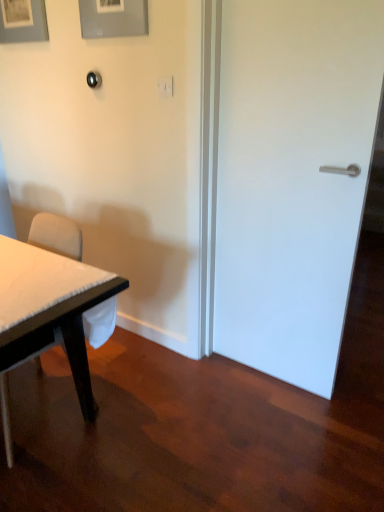
Where is `white matte door at right`? white matte door at right is located at coordinates (292, 179).

Find the location of a particular element. This screenshot has height=512, width=384. white fabric chair at left is located at coordinates (56, 234).

Is white matte door at right outside of white fabric chair at left?

white matte door at right is positioned outside white fabric chair at left.

I want to click on door that is behind the white fabric chair at left, so click(x=292, y=179).

Which object is more forward, white matte door at right or white fabric chair at left?

white fabric chair at left is closer to the camera.

From a real-world perspective, between white matte door at right and white fabric chair at left, who is vertically lower?

white fabric chair at left is physically lower.

Looking at this image, from the image's perspective, who appears lower, matte gray picture frame at upper center, which is the 2th picture frame in back-to-front order, or matte gray picture frame at upper left, which is the first picture frame from left to right?

matte gray picture frame at upper center, which is the 2th picture frame in back-to-front order, appears lower in the image.

Which object is thinner, matte gray picture frame at upper center, which is the 1th picture frame from right to left, or matte gray picture frame at upper left, which is the 2th picture frame in right-to-left order?

With smaller width is matte gray picture frame at upper center, which is the 1th picture frame from right to left.

Who is shorter, matte gray picture frame at upper center, acting as the first picture frame starting from the front, or matte gray picture frame at upper left, which appears as the 1th picture frame when viewed from the back?

matte gray picture frame at upper center, acting as the first picture frame starting from the front, is shorter.

Relative to matte gray picture frame at upper left, which is the 2th picture frame in right-to-left order, is matte gray picture frame at upper center, acting as the first picture frame starting from the front, in front or behind?

In the image, matte gray picture frame at upper center, acting as the first picture frame starting from the front, appears in front of matte gray picture frame at upper left, which is the 2th picture frame in right-to-left order.

Is white matte door at right outside of matte gray picture frame at upper center, which is the 2th picture frame in back-to-front order?

white matte door at right lies outside matte gray picture frame at upper center, which is the 2th picture frame in back-to-front order,'s area.

From the image's perspective, is white matte door at right above matte gray picture frame at upper center, the 2th picture frame from the left?

Actually, white matte door at right appears below matte gray picture frame at upper center, the 2th picture frame from the left, in the image.

From a real-world perspective, which is physically below, white matte door at right or matte gray picture frame at upper center, the 2th picture frame from the left?

In real-world perspective, white matte door at right is lower.

Could you measure the distance between white matte door at right and matte gray picture frame at upper center, which is the 2th picture frame in back-to-front order?

white matte door at right is 35.97 inches from matte gray picture frame at upper center, which is the 2th picture frame in back-to-front order.

From the image's perspective, does matte gray picture frame at upper left, which appears as the 1th picture frame when viewed from the back, appear lower than white fabric chair at left?

No, from the image's perspective, matte gray picture frame at upper left, which appears as the 1th picture frame when viewed from the back, is not below white fabric chair at left.

Is matte gray picture frame at upper left, which is the first picture frame from left to right, positioned before white fabric chair at left?

No, it is not.

Consider the image. From a real-world perspective, which object stands above the other?

matte gray picture frame at upper left, which is the first picture frame from left to right.

Which is more distant, (47, 27) or (9, 460)?

Point (47, 27)

From a real-world perspective, is matte gray picture frame at upper left, which is the 2th picture frame in right-to-left order, positioned over white matte door at right based on gravity?

Yes, from a real-world perspective, matte gray picture frame at upper left, which is the 2th picture frame in right-to-left order, is above white matte door at right.

Considering the sizes of objects matte gray picture frame at upper left, which is the 2th picture frame in right-to-left order, and white matte door at right in the image provided, who is shorter, matte gray picture frame at upper left, which is the 2th picture frame in right-to-left order, or white matte door at right?

matte gray picture frame at upper left, which is the 2th picture frame in right-to-left order.

Considering the sizes of objects matte gray picture frame at upper left, which is the 2th picture frame in right-to-left order, and white matte door at right in the image provided, who is wider, matte gray picture frame at upper left, which is the 2th picture frame in right-to-left order, or white matte door at right?

Wider between the two is matte gray picture frame at upper left, which is the 2th picture frame in right-to-left order.

Between point (27, 37) and point (241, 93), which one is positioned behind?

The point (27, 37) is farther.

How many degrees apart are the facing directions of white fabric chair at left and matte gray picture frame at upper center, the 2th picture frame from the left?

white fabric chair at left and matte gray picture frame at upper center, the 2th picture frame from the left, are facing 4.61 degrees away from each other.

Considering the positions of objects white fabric chair at left and matte gray picture frame at upper center, which is the 2th picture frame in back-to-front order, in the image provided, who is more to the left, white fabric chair at left or matte gray picture frame at upper center, which is the 2th picture frame in back-to-front order,?

From the viewer's perspective, white fabric chair at left appears more on the left side.

This screenshot has height=512, width=384. In order to click on chair below the matte gray picture frame at upper center, the 2th picture frame from the left (from a real-world perspective) in this screenshot , I will do `click(56, 234)`.

From a real-world perspective, does white fabric chair at left stand above matte gray picture frame at upper center, the 2th picture frame from the left?

No, from a real-world perspective, white fabric chair at left is not over matte gray picture frame at upper center, the 2th picture frame from the left

Is matte gray picture frame at upper left, acting as the 2th picture frame starting from the front, bigger than matte gray picture frame at upper center, the 2th picture frame from the left?

Indeed, matte gray picture frame at upper left, acting as the 2th picture frame starting from the front, has a larger size compared to matte gray picture frame at upper center, the 2th picture frame from the left.

Which is further, (29,5) or (86,36)?

The point (29,5) is farther.

Would you say matte gray picture frame at upper left, which is the first picture frame from left to right, is a long distance from matte gray picture frame at upper center, acting as the first picture frame starting from the front?

They are positioned close to each other.

Where is `chair below the white matte door at right (from the image's perspective)`? This screenshot has width=384, height=512. chair below the white matte door at right (from the image's perspective) is located at coordinates (56, 234).

I want to click on picture frame in front of the matte gray picture frame at upper left, acting as the 2th picture frame starting from the front, so click(x=113, y=18).

Which object lies further to the anchor point matte gray picture frame at upper center, acting as the first picture frame starting from the front, matte gray picture frame at upper left, acting as the 2th picture frame starting from the front, or white fabric chair at left?

white fabric chair at left.

Which object lies further to the anchor point white fabric chair at left, matte gray picture frame at upper left, which appears as the 1th picture frame when viewed from the back, or white matte door at right?

matte gray picture frame at upper left, which appears as the 1th picture frame when viewed from the back, is further to white fabric chair at left.

Estimate the real-world distances between objects in this image. Which object is further from matte gray picture frame at upper center, the 2th picture frame from the left, matte gray picture frame at upper left, which appears as the 1th picture frame when viewed from the back, or white matte door at right?

The object further to matte gray picture frame at upper center, the 2th picture frame from the left, is white matte door at right.

Looking at the image, which one is located closer to white matte door at right, matte gray picture frame at upper left, which is the first picture frame from left to right, or white fabric chair at left?

white fabric chair at left.

Looking at the image, which one is located closer to white matte door at right, matte gray picture frame at upper center, the 2th picture frame from the left, or white fabric chair at left?

matte gray picture frame at upper center, the 2th picture frame from the left, is closer to white matte door at right.

Looking at the image, which one is located further to matte gray picture frame at upper center, acting as the first picture frame starting from the front, white matte door at right or white fabric chair at left?

white fabric chair at left.

Considering their positions, is white fabric chair at left positioned closer to white matte door at right than matte gray picture frame at upper center, which is the 1th picture frame from right to left?

matte gray picture frame at upper center, which is the 1th picture frame from right to left, is closer to white matte door at right.

Looking at the image, which one is located further to white fabric chair at left, matte gray picture frame at upper center, which is the 2th picture frame in back-to-front order, or white matte door at right?

The object further to white fabric chair at left is white matte door at right.

Find the location of a particular element. This screenshot has height=512, width=384. door between matte gray picture frame at upper left, acting as the 2th picture frame starting from the front, and white fabric chair at left in the up-down direction is located at coordinates (292, 179).

Identify the location of picture frame that lies between matte gray picture frame at upper left, which is the first picture frame from left to right, and white fabric chair at left from top to bottom. The image size is (384, 512). [113, 18].

The height and width of the screenshot is (512, 384). Identify the location of door between matte gray picture frame at upper center, which is the 2th picture frame in back-to-front order, and white fabric chair at left, in the vertical direction. (292, 179).

At what (x,y) coordinates should I click in order to perform the action: click on picture frame located between matte gray picture frame at upper left, acting as the 2th picture frame starting from the front, and white matte door at right in the left-right direction. Please return your answer as a coordinate pair (x, y). Looking at the image, I should click on (113, 18).